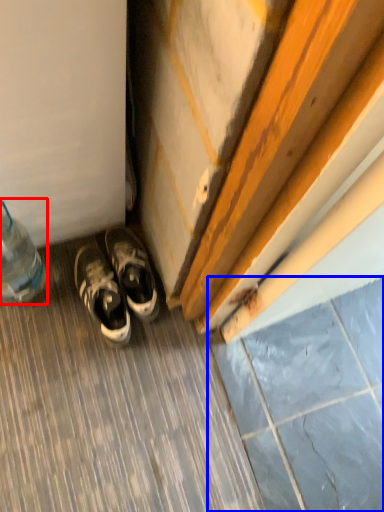
Question: Which point is further to the camera, bottle (highlighted by a red box) or tile (highlighted by a blue box)?

Choices:
 (A) bottle
 (B) tile

Answer: (B)